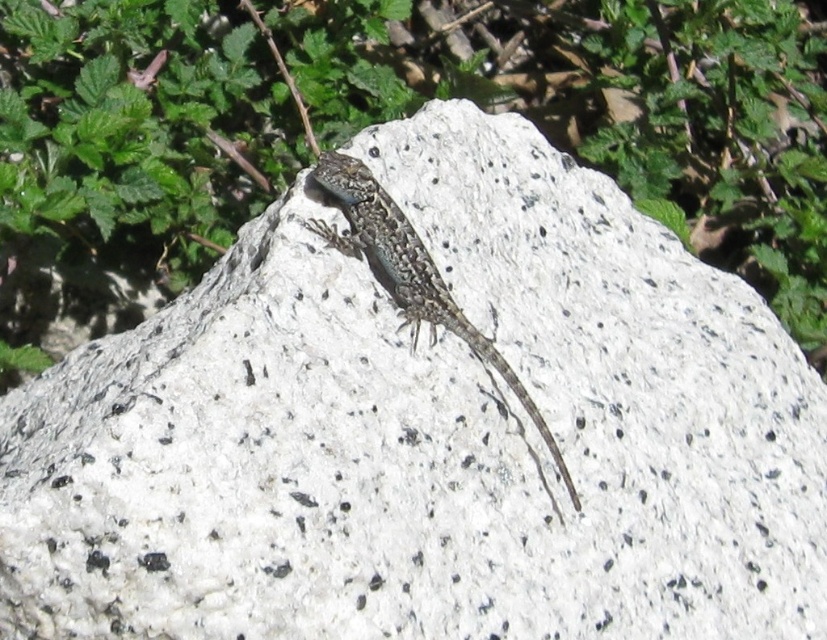
Based on the photo, which of these two, green leafy plant at upper center or speckled stone lizard at center, stands shorter?

speckled stone lizard at center is shorter.

Who is more forward, (790, 214) or (355, 198)?

Point (355, 198) is more forward.

What do you see at coordinates (410, 113) in the screenshot? The height and width of the screenshot is (640, 827). I see `green leafy plant at upper center` at bounding box center [410, 113].

Where is `green leafy plant at upper center`? The width and height of the screenshot is (827, 640). green leafy plant at upper center is located at coordinates (410, 113).